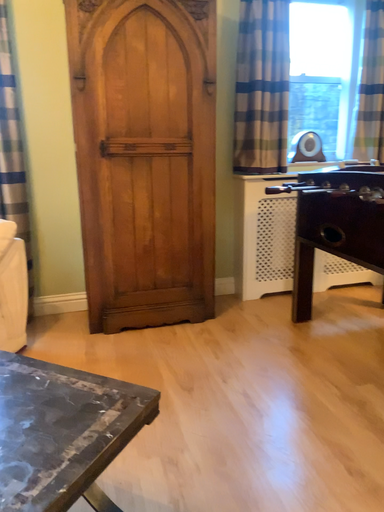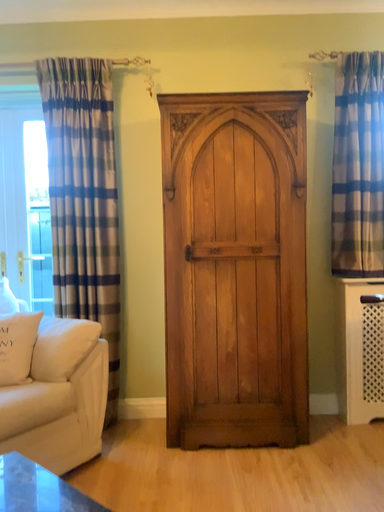
Question: How did the camera likely rotate when shooting the video?

Choices:
 (A) rotated left
 (B) rotated right

Answer: (A)